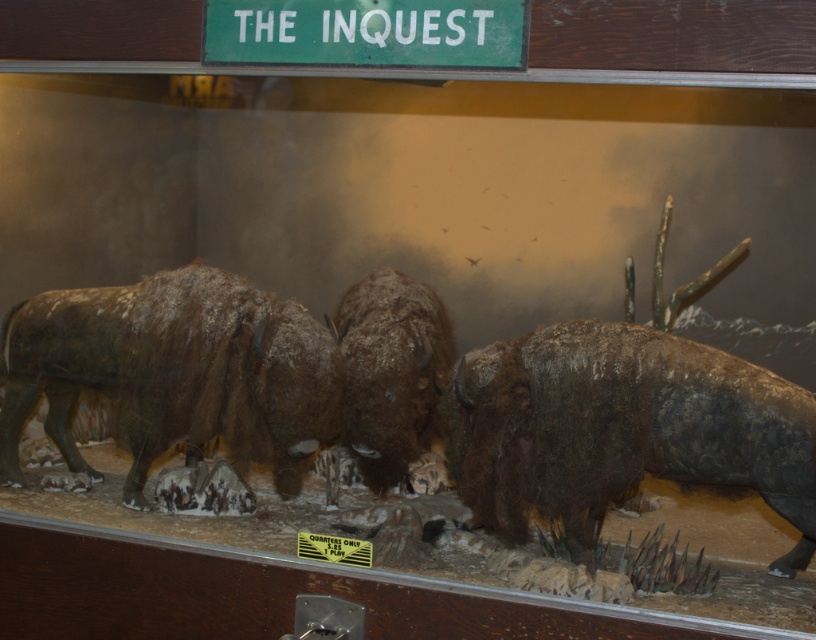
Question: Considering the real-world distances, which object is farthest from the brown fuzzy yak at center?

Choices:
 (A) brown fuzzy yak at right
 (B) brown fuzzy yak at left

Answer: (A)

Question: Which point is closer to the camera?

Choices:
 (A) brown fuzzy yak at center
 (B) brown fuzzy yak at right
 (C) brown fuzzy yak at left

Answer: (B)

Question: Does brown fuzzy yak at left appear under brown fuzzy yak at center?

Choices:
 (A) yes
 (B) no

Answer: (A)

Question: Based on their relative distances, which object is nearer to the brown fuzzy yak at left?

Choices:
 (A) brown fuzzy yak at center
 (B) brown fuzzy yak at right

Answer: (A)

Question: From the image, what is the correct spatial relationship of brown fuzzy yak at left in relation to brown fuzzy yak at center?

Choices:
 (A) above
 (B) below

Answer: (B)

Question: Does brown fuzzy yak at left appear on the left side of brown fuzzy yak at center?

Choices:
 (A) no
 (B) yes

Answer: (B)